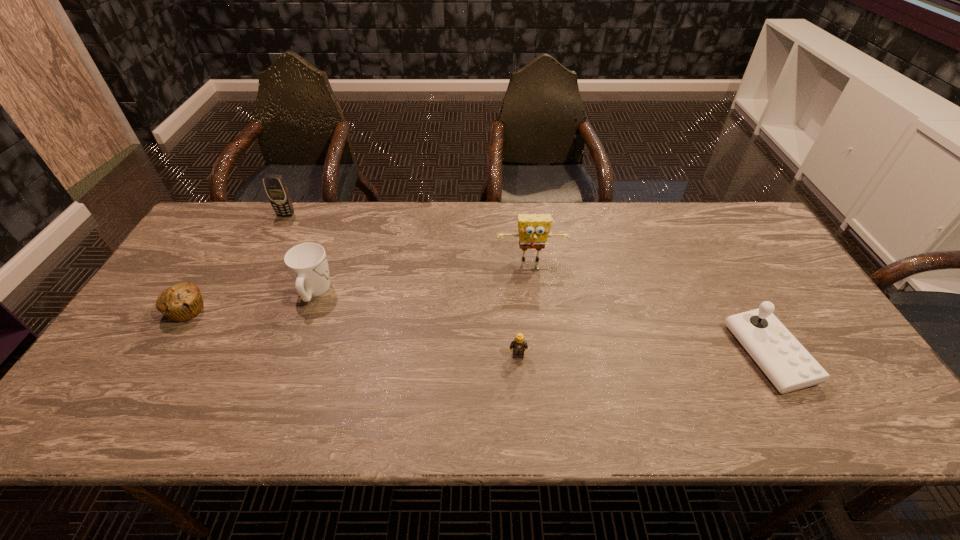
This screenshot has height=540, width=960. Identify the location of vacant space located 0.120m on the side of the mug with the handle. (331, 247).

You are a GUI agent. You are given a task and a screenshot of the screen. Output one action in this format:
    pyautogui.click(x=<x>, y=<y>)
    Task: Click on the vacant region located on the side of the mug with the handle
    Image resolution: width=960 pixels, height=540 pixels.
    Given the screenshot: What is the action you would take?
    pyautogui.click(x=336, y=233)

In order to click on vacant point located on the left of the joystick in this screenshot , I will do `click(592, 354)`.

You are a GUI agent. You are given a task and a screenshot of the screen. Output one action in this format:
    pyautogui.click(x=<x>, y=<y>)
    Task: Click on the free space located on the right of the muffin
    The image size is (960, 540).
    Given the screenshot: What is the action you would take?
    pyautogui.click(x=356, y=310)

Locate an element on the screen. free space located in front of the Lego is located at coordinates (522, 421).

Locate an element on the screen. The image size is (960, 540). object that is positioned at the far edge is located at coordinates 277,191.

Image resolution: width=960 pixels, height=540 pixels. Find the location of `object that is at the near edge`. object that is at the near edge is located at coordinates (789, 366).

You are a GUI agent. You are given a task and a screenshot of the screen. Output one action in this format:
    pyautogui.click(x=<x>, y=<y>)
    Task: Click on the object that is at the left edge
    This screenshot has width=960, height=540.
    Given the screenshot: What is the action you would take?
    pyautogui.click(x=183, y=301)

The width and height of the screenshot is (960, 540). Find the location of `object present at the right edge`. object present at the right edge is located at coordinates (789, 366).

Locate an element on the screen. object present at the near right corner is located at coordinates (789, 366).